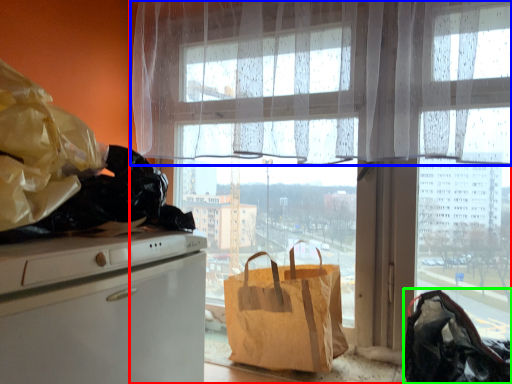
Question: Which object is positioned closest to window (highlighted by a red box)? Select from curtain (highlighted by a blue box) and handbag (highlighted by a green box).

Choices:
 (A) curtain
 (B) handbag

Answer: (A)